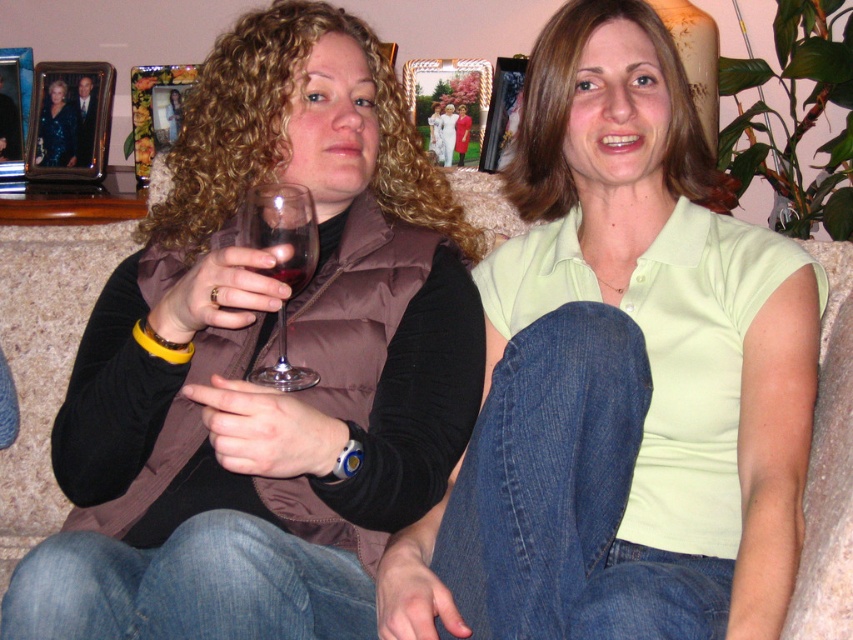
Is brown satin vest at center to the right of metallic silver picture frame at upper left from the viewer's perspective?

Indeed, brown satin vest at center is positioned on the right side of metallic silver picture frame at upper left.

Can you confirm if brown satin vest at center is positioned below metallic silver picture frame at upper left?

Indeed, brown satin vest at center is positioned under metallic silver picture frame at upper left.

Locate an element on the screen. This screenshot has width=853, height=640. brown satin vest at center is located at coordinates (263, 358).

Is point (91, 77) positioned before point (16, 138)?

Yes, it is.

You are a GUI agent. You are given a task and a screenshot of the screen. Output one action in this format:
    pyautogui.click(x=<x>, y=<y>)
    Task: Click on the metallic silver picture frame at upper left
    
    Given the screenshot: What is the action you would take?
    pyautogui.click(x=68, y=120)

Locate an element on the screen. metallic silver picture frame at upper left is located at coordinates (68, 120).

Which is above, brown satin vest at center or metallic silver picture frame at upper center?

Positioned higher is metallic silver picture frame at upper center.

Based on the photo, does brown satin vest at center appear on the right side of metallic silver picture frame at upper center?

Incorrect, brown satin vest at center is not on the right side of metallic silver picture frame at upper center.

Image resolution: width=853 pixels, height=640 pixels. Find the location of `brown satin vest at center`. brown satin vest at center is located at coordinates pos(263,358).

You are a GUI agent. You are given a task and a screenshot of the screen. Output one action in this format:
    pyautogui.click(x=<x>, y=<y>)
    Task: Click on the brown satin vest at center
    The image size is (853, 640).
    Given the screenshot: What is the action you would take?
    pyautogui.click(x=263, y=358)